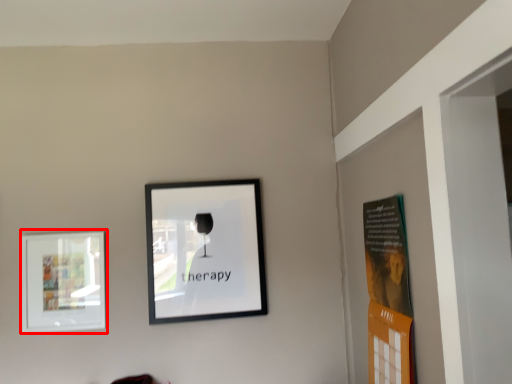
Question: From the image, what is the correct spatial relationship of picture frame (annotated by the red box) in relation to picture frame?

Choices:
 (A) right
 (B) left

Answer: (B)